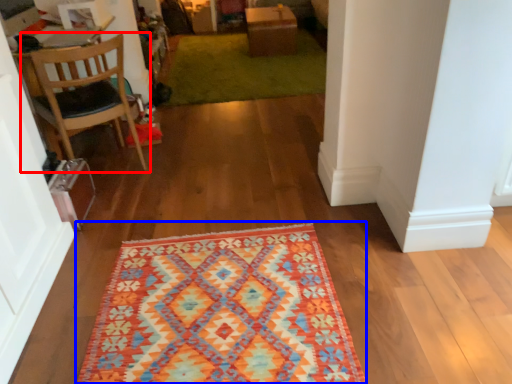
Question: Among these objects, which one is farthest to the camera, chair (highlighted by a red box) or mat (highlighted by a blue box)?

Choices:
 (A) chair
 (B) mat

Answer: (A)